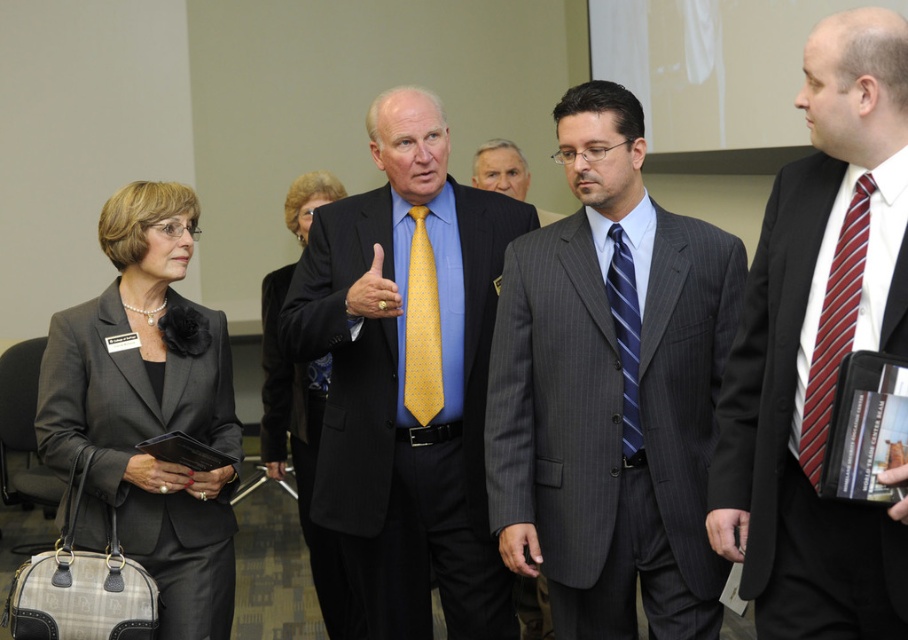
Which is more to the right, matte gray blazer at left or yellow dotted tie at center?

Positioned to the right is yellow dotted tie at center.

Describe the element at coordinates (147, 410) in the screenshot. I see `matte gray blazer at left` at that location.

Who is more distant from viewer, (139, 536) or (439, 340)?

The point (439, 340) is more distant.

Where is `matte gray blazer at left`? This screenshot has width=908, height=640. matte gray blazer at left is located at coordinates (147, 410).

Who is higher up, gray pinstripe suit at center or yellow dotted tie at center?

Positioned higher is yellow dotted tie at center.

Does gray pinstripe suit at center have a greater width compared to yellow dotted tie at center?

Correct, the width of gray pinstripe suit at center exceeds that of yellow dotted tie at center.

I want to click on gray pinstripe suit at center, so click(x=612, y=417).

Does point (623, 273) come behind point (388, 307)?

No, it is not.

Where is `blue striped tie at center`? blue striped tie at center is located at coordinates (625, 340).